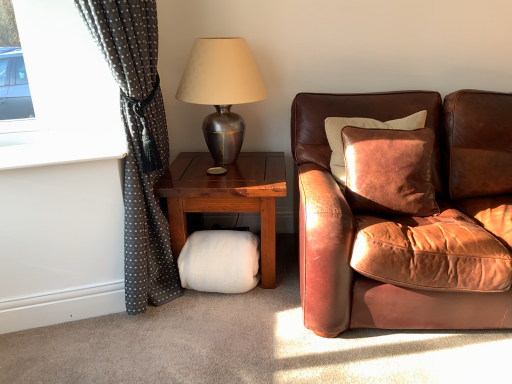
Where is `unoccupied region to the right of dark grey polka dot fabric at left`? This screenshot has height=384, width=512. unoccupied region to the right of dark grey polka dot fabric at left is located at coordinates (237, 327).